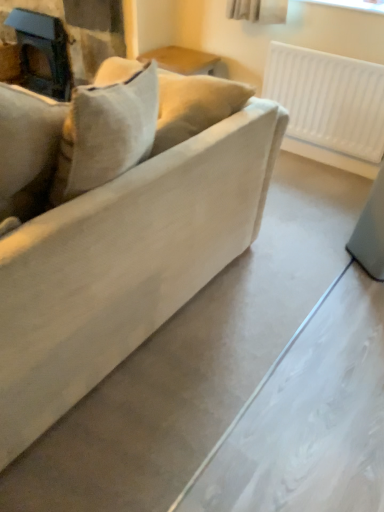
From the picture: Measure the distance between white plastic radiator at upper right and camera.

The distance of white plastic radiator at upper right from camera is 7.39 feet.

This screenshot has height=512, width=384. Describe the element at coordinates (116, 226) in the screenshot. I see `matte beige couch at center` at that location.

The image size is (384, 512). What do you see at coordinates (77, 30) in the screenshot?
I see `matte black fireplace at upper left` at bounding box center [77, 30].

Image resolution: width=384 pixels, height=512 pixels. Identify the location of white plastic radiator at upper right. (329, 99).

How much distance is there between white plastic radiator at upper right and matte beige couch at center?

white plastic radiator at upper right is 1.44 meters from matte beige couch at center.

Which object is further away from the camera taking this photo, white plastic radiator at upper right or matte beige couch at center?

white plastic radiator at upper right is further away from the camera.

Based on the photo, which object is positioned more to the right, white plastic radiator at upper right or matte beige couch at center?

white plastic radiator at upper right.

Looking at this image, from a real-world perspective, which is physically above, white plastic radiator at upper right or matte beige couch at center?

matte beige couch at center is physically above.

How distant is matte beige couch at center from white plastic radiator at upper right?

matte beige couch at center and white plastic radiator at upper right are 1.44 meters apart.

Considering the relative sizes of matte beige couch at center and white plastic radiator at upper right in the image provided, is matte beige couch at center thinner than white plastic radiator at upper right?

No.

From the image's perspective, would you say matte beige couch at center is shown under white plastic radiator at upper right?

Yes.

Does point (0, 231) come in front of point (338, 92)?

Yes, point (0, 231) is closer to viewer.

Is matte black fireplace at upper left directly adjacent to white plastic radiator at upper right?

There is a gap between matte black fireplace at upper left and white plastic radiator at upper right.

Relative to white plastic radiator at upper right, is matte black fireplace at upper left in front or behind?

Clearly, matte black fireplace at upper left is behind white plastic radiator at upper right.

Is point (107, 10) less distant than point (378, 78)?

No.

Identify the location of studio couch below the matte black fireplace at upper left (from the image's perspective). (116, 226).

Which object is wider, matte beige couch at center or matte black fireplace at upper left?

matte beige couch at center is wider.

Considering the points (76, 367) and (84, 48), which point is in front, point (76, 367) or point (84, 48)?

Point (76, 367)

Between matte black fireplace at upper left and matte beige couch at center, which one is positioned in front?

Positioned in front is matte beige couch at center.

Between matte black fireplace at upper left and matte beige couch at center, which one has smaller size?

matte black fireplace at upper left.

Can you tell me how much matte black fireplace at upper left and matte beige couch at center differ in facing direction?

91.1 degrees separate the facing orientations of matte black fireplace at upper left and matte beige couch at center.

The image size is (384, 512). I want to click on studio couch on the right of matte black fireplace at upper left, so click(x=116, y=226).

Considering the positions of points (278, 92) and (13, 37), is point (278, 92) farther from camera compared to point (13, 37)?

No, (278, 92) is closer to viewer.

Is white plastic radiator at upper right oriented towards matte black fireplace at upper left?

No, white plastic radiator at upper right is not turned towards matte black fireplace at upper left.

Would you say white plastic radiator at upper right is inside or outside matte black fireplace at upper left?

white plastic radiator at upper right is not inside matte black fireplace at upper left, it's outside.

Are white plastic radiator at upper right and matte black fireplace at upper left beside each other?

No, white plastic radiator at upper right is not making contact with matte black fireplace at upper left.

In order to click on radiator on the right side of matte beige couch at center in this screenshot , I will do `click(329, 99)`.

Find the location of a particular element. The image size is (384, 512). studio couch below the white plastic radiator at upper right (from the image's perspective) is located at coordinates (116, 226).

When comparing their distances from white plastic radiator at upper right, does matte beige couch at center or matte black fireplace at upper left seem further?

matte beige couch at center lies further to white plastic radiator at upper right than the other object.

When comparing their distances from matte black fireplace at upper left, does white plastic radiator at upper right or matte beige couch at center seem further?

matte beige couch at center lies further to matte black fireplace at upper left than the other object.

Which object lies nearer to the anchor point matte black fireplace at upper left, matte beige couch at center or white plastic radiator at upper right?

The object closer to matte black fireplace at upper left is white plastic radiator at upper right.

Estimate the real-world distances between objects in this image. Which object is closer to matte beige couch at center, white plastic radiator at upper right or matte black fireplace at upper left?

Based on the image, white plastic radiator at upper right appears to be nearer to matte beige couch at center.

Estimate the real-world distances between objects in this image. Which object is further from matte beige couch at center, matte black fireplace at upper left or white plastic radiator at upper right?

The object further to matte beige couch at center is matte black fireplace at upper left.

From the image, which object appears to be farther from white plastic radiator at upper right, matte black fireplace at upper left or matte beige couch at center?

matte beige couch at center.

Identify the location of radiator between matte beige couch at center and matte black fireplace at upper left in the front-back direction. (329, 99).